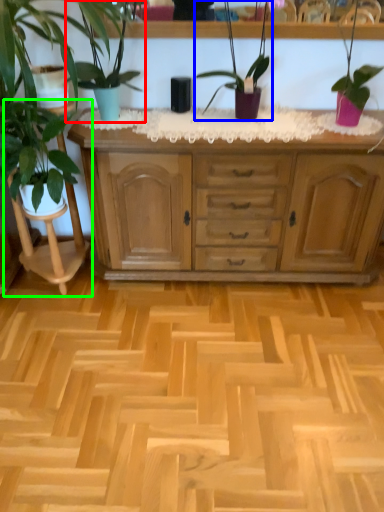
Question: Which object is positioned closest to houseplant (highlighted by a red box)? Select from houseplant (highlighted by a blue box) and rocking chair (highlighted by a green box).

Choices:
 (A) houseplant
 (B) rocking chair

Answer: (A)